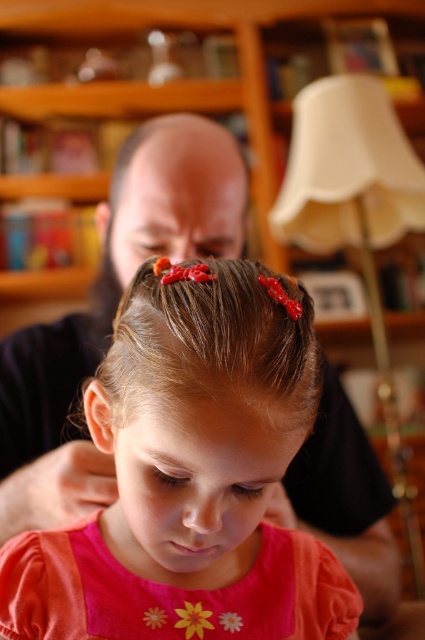
You are a photographer setting up for a family portrait. You notice the pink satin dress at center and the brown shiny hair at center in the scene. Which object occupies more horizontal space in the image?

The pink satin dress at center occupies more horizontal space than the brown shiny hair at center because its width is larger.

You are an interior designer assessing the lighting in this room. You notice the white fabric lampshade at upper right and the brown shiny hair at center. Which object would cast a wider shadow on the wall?

The white fabric lampshade at upper right would cast a wider shadow on the wall because it has a larger size compared to the brown shiny hair at center.

You are a photographer setting up for a family portrait. The subject is the young girl in the foreground wearing a bright pink top with floral embroidery. You want to ensure the white fabric lampshade at upper right is in focus while capturing the girl clearly. Given that the lampshade is 1.39 meters away from the camera, what is the minimum focusing distance your camera should have to achieve this?

The white fabric lampshade at upper right is 1.39 meters away from the camera. To capture it in focus along with the girl in the foreground, the camera must have a focusing distance of at least 1.39 meters.